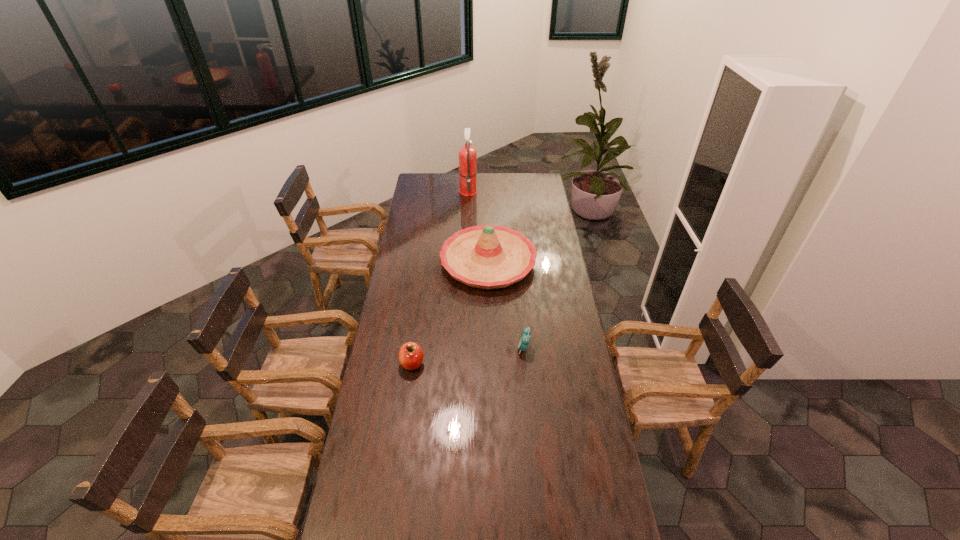
Where is `blank region between the leftmost object and the third nearest object`? The height and width of the screenshot is (540, 960). blank region between the leftmost object and the third nearest object is located at coordinates (450, 313).

Identify the location of blank region between the apple and the tallest object. point(441,277).

Choose which object is the third nearest neighbor to the leftmost object. Please provide its 2D coordinates. Your answer should be formatted as a tuple, i.e. [(x, y)], where the tuple contains the x and y coordinates of a point satisfying the conditions above.

[(467, 155)]

Where is `the second closest object relative to the alarm clock`? The image size is (960, 540). the second closest object relative to the alarm clock is located at coordinates (410, 356).

Locate an element on the screen. Image resolution: width=960 pixels, height=540 pixels. vacant space that satisfies the following two spatial constraints: 1. with the handle and hose on the second tallest object; 2. on the left side of the fire extinguisher is located at coordinates (466, 262).